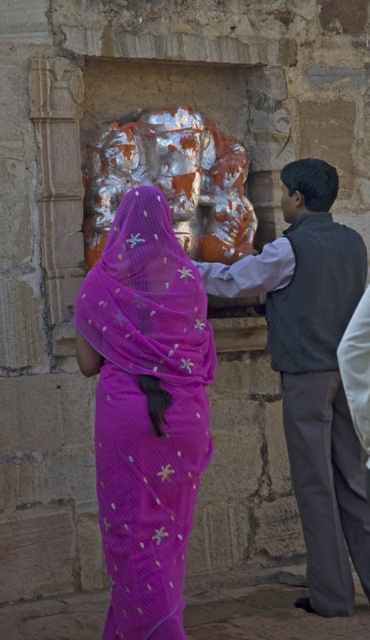
You are an observer standing in front of the temple scene. You notice two items at the center of the image. Which item is located to the left when comparing the purple sheer sari at center and the gray woolen vest at center?

The purple sheer sari at center is positioned on the left side of the gray woolen vest at center, so the purple sheer sari at center is located to the left.

You are a photographer standing in front of the temple scene. You want to take a photo that includes both the purple sheer sari at center and the gray woolen vest at center. What is the minimum distance you need to move backward to ensure both items are in frame?

The purple sheer sari at center and gray woolen vest at center are 1.80 meters apart. To capture both in the frame, you need to move back at least 1.80 meters to ensure the camera can encompass the entire distance between them.

You are an event planner organizing a cultural festival. You need to place a decorative banner between the purple sheer sari at center and the shiny metallic statue at center. Since the banner must be placed where there is enough space between them, can you determine if the space between them is wide enough for a 1.2 meter wide banner?

The purple sheer sari at center is narrower than the shiny metallic statue at center. However, the description provided does not specify the exact distance between them, so it is unclear if the space between them is sufficient for a 1.2 meter wide banner. Additional measurements would be needed to confirm.